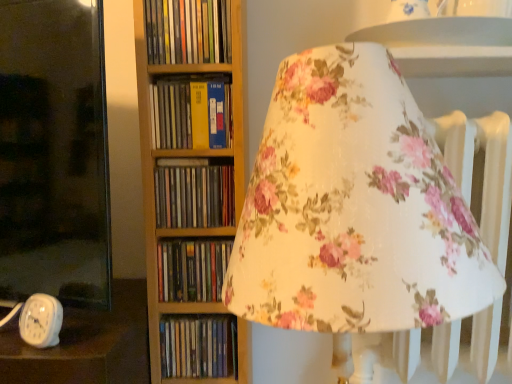
Question: Is hardcover books at center, marked as the first book in a top-to-bottom arrangement, wider than matte plastic books at center, arranged as the 1th book when ordered from the bottom?

Choices:
 (A) yes
 (B) no

Answer: (A)

Question: From the image's perspective, would you say hardcover books at center, placed as the fifth book when sorted from bottom to top, is positioned over matte plastic books at center, arranged as the 1th book when ordered from the bottom?

Choices:
 (A) yes
 (B) no

Answer: (A)

Question: Is matte plastic books at center, arranged as the 1th book when ordered from the bottom, inside hardcover books at center, marked as the first book in a top-to-bottom arrangement?

Choices:
 (A) no
 (B) yes

Answer: (A)

Question: Would you consider hardcover books at center, placed as the fifth book when sorted from bottom to top, to be distant from matte plastic books at center, arranged as the 1th book when ordered from the bottom?

Choices:
 (A) yes
 (B) no

Answer: (B)

Question: From a real-world perspective, is hardcover books at center, marked as the first book in a top-to-bottom arrangement, below matte plastic books at center, arranged as the 1th book when ordered from the bottom?

Choices:
 (A) no
 (B) yes

Answer: (A)

Question: From a real-world perspective, is matte plastic books at center, placed as the fifth book when sorted from top to bottom, physically located above or below brown cardboard book at center, placed as the third book when sorted from bottom to top?

Choices:
 (A) below
 (B) above

Answer: (A)

Question: Considering the positions of matte plastic books at center, placed as the fifth book when sorted from top to bottom, and brown cardboard book at center, placed as the third book when sorted from bottom to top, in the image, is matte plastic books at center, placed as the fifth book when sorted from top to bottom, wider or thinner than brown cardboard book at center, placed as the third book when sorted from bottom to top,?

Choices:
 (A) thin
 (B) wide

Answer: (A)

Question: Considering the positions of matte plastic books at center, arranged as the 1th book when ordered from the bottom, and brown cardboard book at center, which is the 3th book in top-to-bottom order, in the image, is matte plastic books at center, arranged as the 1th book when ordered from the bottom, bigger or smaller than brown cardboard book at center, which is the 3th book in top-to-bottom order,?

Choices:
 (A) small
 (B) big

Answer: (A)

Question: Visually, is matte plastic books at center, placed as the fifth book when sorted from top to bottom, positioned to the left or to the right of brown cardboard book at center, placed as the third book when sorted from bottom to top?

Choices:
 (A) left
 (B) right

Answer: (B)

Question: Is matte plastic books at center, arranged as the 1th book when ordered from the bottom, spatially inside hardcover books at center, placed as the fifth book when sorted from bottom to top, or outside of it?

Choices:
 (A) outside
 (B) inside

Answer: (A)

Question: From the image's perspective, is matte plastic books at center, placed as the fifth book when sorted from top to bottom, positioned above or below hardcover books at center, placed as the fifth book when sorted from bottom to top?

Choices:
 (A) above
 (B) below

Answer: (B)

Question: From a real-world perspective, is matte plastic books at center, arranged as the 1th book when ordered from the bottom, above or below hardcover books at center, placed as the fifth book when sorted from bottom to top?

Choices:
 (A) below
 (B) above

Answer: (A)

Question: Would you say matte plastic books at center, placed as the fifth book when sorted from top to bottom, is to the left or to the right of hardcover books at center, placed as the fifth book when sorted from bottom to top, in the picture?

Choices:
 (A) right
 (B) left

Answer: (A)

Question: In the image, is hardcover books at center, marked as the first book in a top-to-bottom arrangement, positioned in front of or behind brown cardboard book at center, placed as the third book when sorted from bottom to top?

Choices:
 (A) behind
 (B) front

Answer: (B)

Question: Which is correct: hardcover books at center, placed as the fifth book when sorted from bottom to top, is inside brown cardboard book at center, placed as the third book when sorted from bottom to top, or outside of it?

Choices:
 (A) inside
 (B) outside

Answer: (B)